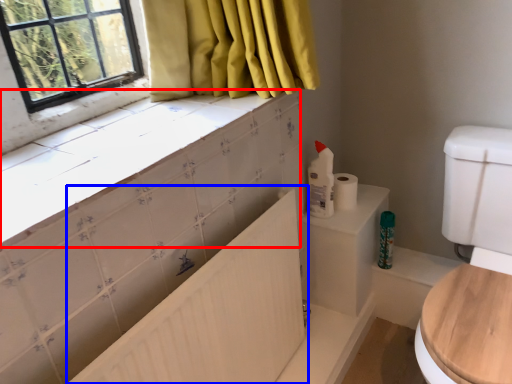
Question: Which point is closer to the camera, counter top (highlighted by a red box) or bath (highlighted by a blue box)?

Choices:
 (A) counter top
 (B) bath

Answer: (A)